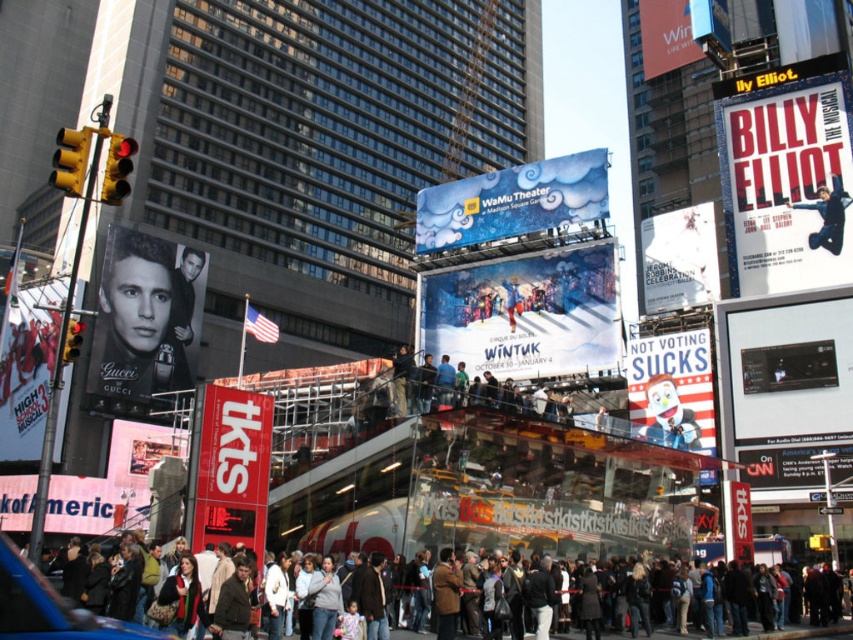
Question: Which is nearer to the matte black poster at left?

Choices:
 (A) matte red poster at upper right
 (B) white paper sign at center
 (C) matte blue poster at center
 (D) white digital screen at center

Answer: (D)

Question: Does matte red poster at upper right come in front of white glossy screen at upper right?

Choices:
 (A) yes
 (B) no

Answer: (B)

Question: Is white paper at upper right bigger than white glossy sign at center?

Choices:
 (A) yes
 (B) no

Answer: (A)

Question: Does white paper at upper right appear over dark brown leather jacket at lower center?

Choices:
 (A) yes
 (B) no

Answer: (A)

Question: Which point is closer to the camera?

Choices:
 (A) matte red poster at upper right
 (B) blue fabric jacket at upper right
 (C) white glossy screen at upper right

Answer: (C)

Question: Which object is farther from the camera taking this photo?

Choices:
 (A) matte blue poster at center
 (B) white digital screen at center
 (C) dark brown leather jacket at lower center

Answer: (B)